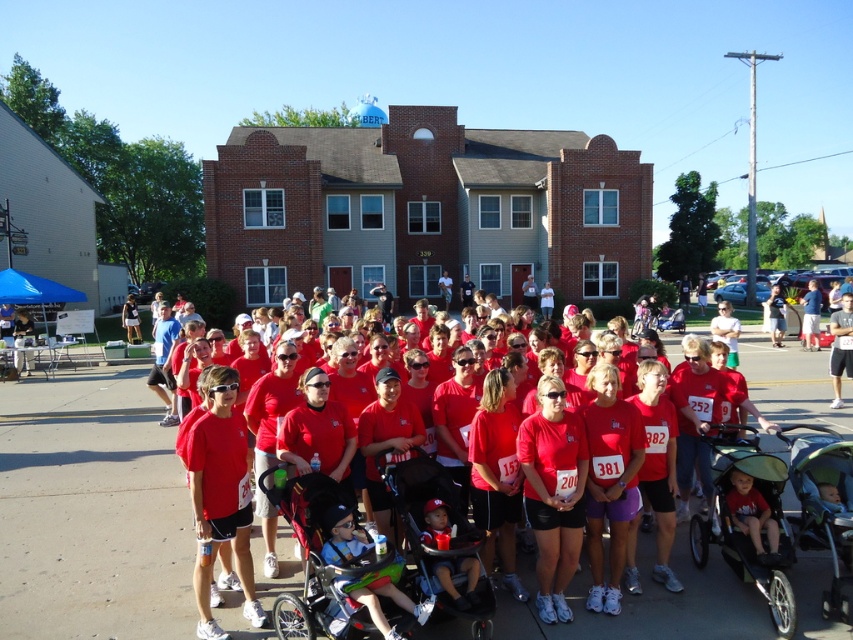
You are a participant in the race and need to find your assigned stroller for the race start. The stroller is located at point [376,557]. Based on the scene description, where exactly is the matte black stroller located?

The matte black stroller at center is located at point [376,557].

You are a participant in the race and you need to check if your stroller can fit between the matte black stroller at center and the matte red shirt at center. Your stroller is 1.5 meters wide. Can it fit?

The distance between the matte black stroller at center and the matte red shirt at center is 1.76 meters. Since your stroller is 1.5 meters wide, it can fit as there is enough space.

You are a photographer standing at the event. You want to take a photo of the matte black stroller at center without including the crowd behind it. The camera has a depth of field that can focus on objects within 4 meters. Can you capture the stroller clearly while keeping the background blurred?

The matte black stroller at center is 4.49 meters away from the camera. Since the depth of field focuses within 4 meters, the stroller is slightly beyond the optimal range, so it might not be as sharp, and the background crowd may still be somewhat visible. Adjusting the camera settings or moving closer could help achieve the desired effect.